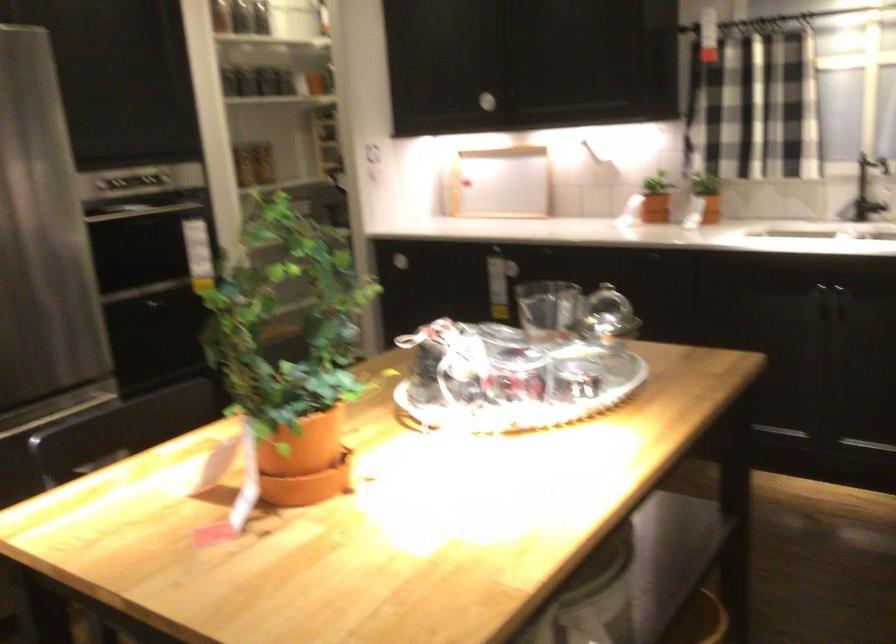
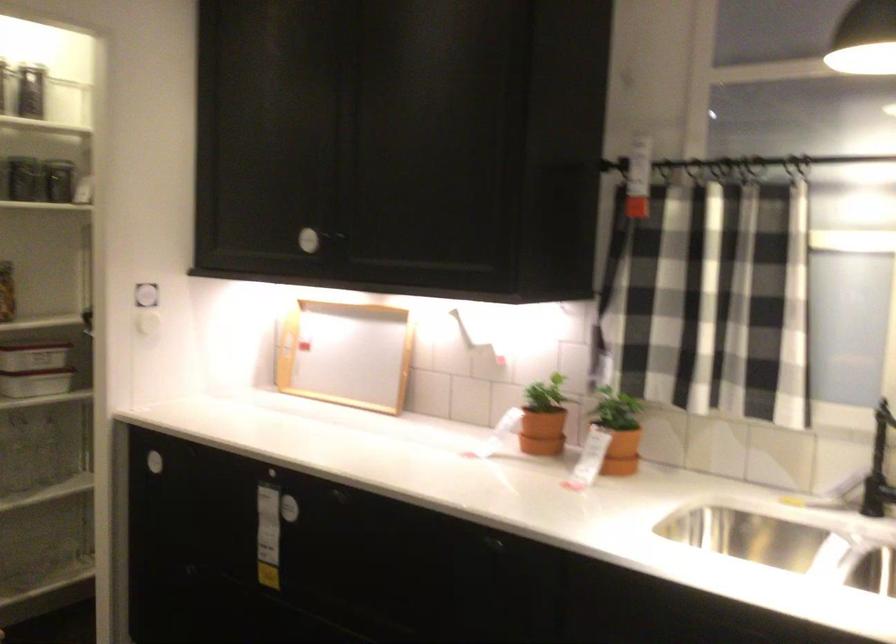
Where in the second image is the point corresponding to the point at 484,91 from the first image?

(307, 240)